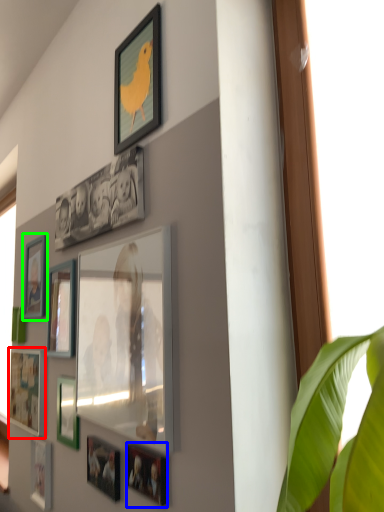
Question: Which object is the farthest from picture frame (highlighted by a red box)? Choose among these: picture frame (highlighted by a blue box) or picture frame (highlighted by a green box).

Choices:
 (A) picture frame
 (B) picture frame

Answer: (A)